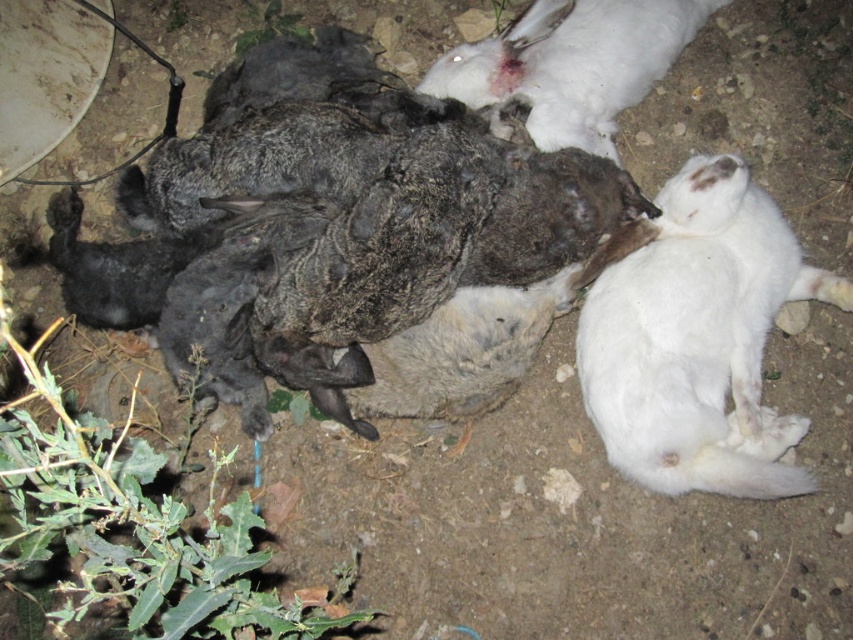
Does white fur cat at right have a lesser height compared to white fur rabbit at upper right?

In fact, white fur cat at right may be taller than white fur rabbit at upper right.

Is white fur cat at right below white fur rabbit at upper right?

Indeed, white fur cat at right is positioned under white fur rabbit at upper right.

Between point (775, 451) and point (634, 86), which one is positioned behind?

The point (634, 86) is more distant.

This screenshot has height=640, width=853. In order to click on white fur cat at right in this screenshot , I will do `click(698, 339)`.